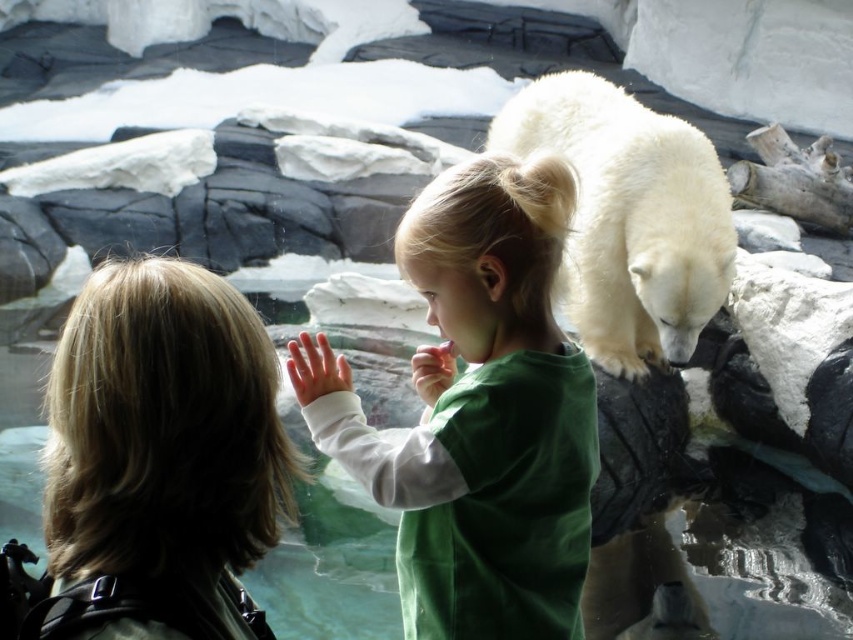
You are standing at the center of the zoo enclosure and want to take a photo of the white fluffy polar bear at upper right without the green cotton shirt at center appearing in the frame. Is this possible given their current positions?

The green cotton shirt at center and white fluffy polar bear at upper right are 1.11 meters apart from each other. Since the distance between them is relatively small, it might be challenging to frame the photo so that the green cotton shirt at center is excluded while capturing the white fluffy polar bear at upper right. However, adjusting the camera angle or zoom could potentially exclude the shirt from the frame depending on the lens and positioning.

You are standing in front of the zoo exhibit and see the green cotton shirt at center and the white fluffy polar bear at upper right. Which one is closer to the glass barrier where you are standing?

The green cotton shirt at center is closer to the glass barrier because it is positioned at center, while the white fluffy polar bear at upper right is further back in the frame.

You are a visitor at the zoo and want to take a photo of the white fluffy polar bear at upper right without including the green cotton shirt at center in the frame. Is it possible to do so by adjusting your camera angle?

The green cotton shirt at center has a lesser width compared to the white fluffy polar bear at upper right, so yes, you can adjust your camera angle to exclude the green cotton shirt at center while capturing the white fluffy polar bear at upper right.